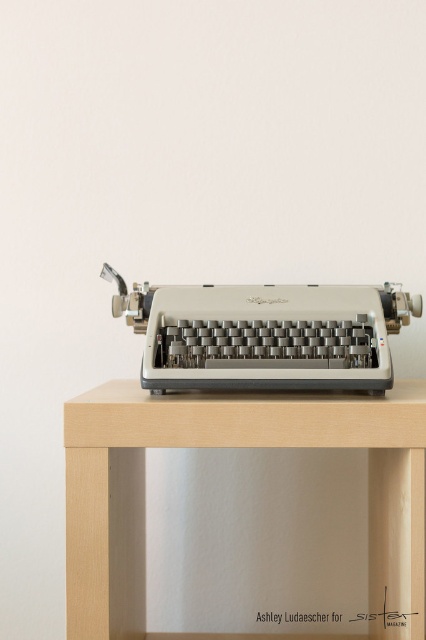
You are standing in front of a vintage typewriter setup. You want to place a 12 inch tall sculpture on the light wood table at center. Considering the table size and your position, can you place it without moving closer or farther from the table?

The light wood table at center is 39.09 inches away from you. Since the sculpture is 12 inches tall, which is less than the table height, you can place it on the light wood table at center without needing to adjust your distance.

You are standing in front of the light wood table at center and the matte silver typewriter at center. Which object is closer to you?

The light wood table at center is closer to you because it is in front of the matte silver typewriter at center.

You are a furniture designer examining the image. You need to place a decorative vase that requires a flat surface lower than the matte silver typewriter at center. Is there a suitable surface available on the light wood table at center?

The light wood table at center has a greater height compared to the matte silver typewriter at center. Since the typewriter is placed on the table, the table itself is higher than the typewriter. Therefore, the surface of the table is not lower than the typewriter. However, if the typewriter has a flat surface on its top, that could be an option, but the description does not mention this. Based on the given information, there is no suitable surface available on the light wood table at center that is lower.